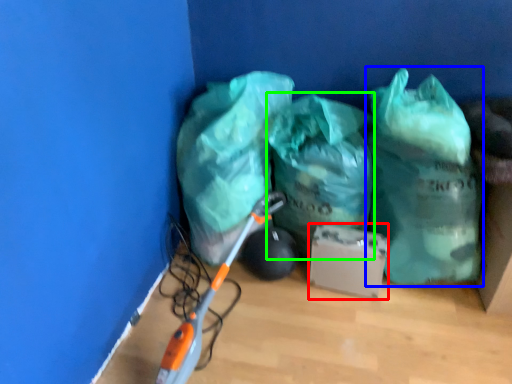
Question: Considering the real-world distances, which object is closest to cardboard box (highlighted by a red box)? plastic bag (highlighted by a blue box) or plastic bag (highlighted by a green box).

Choices:
 (A) plastic bag
 (B) plastic bag

Answer: (B)